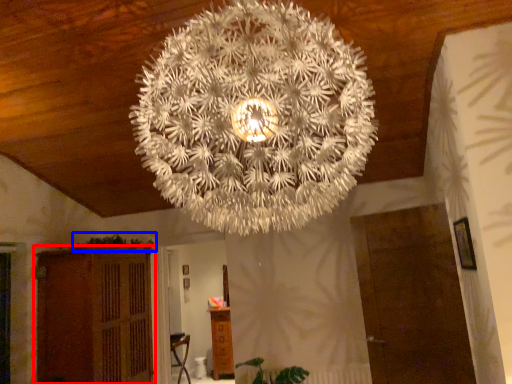
Question: Which point is closer to the camera, furniture (highlighted by a red box) or plant (highlighted by a blue box)?

Choices:
 (A) furniture
 (B) plant

Answer: (A)